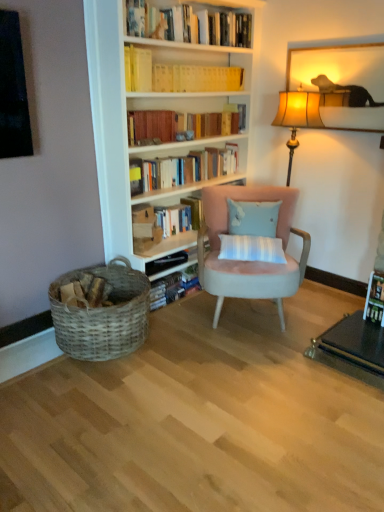
Measure the distance between yellow paperbacks at upper center, which is the 5th book from bottom to top, and camera.

yellow paperbacks at upper center, which is the 5th book from bottom to top, is 8.92 feet away from camera.

The width and height of the screenshot is (384, 512). I want to click on yellow paper at upper center, marked as the second book in a top-to-bottom arrangement, so click(x=138, y=69).

Find the location of a particular element. wooden picture frame at upper right is located at coordinates (338, 63).

What is the approximate height of hardcover books at upper center, the 2th book in the bottom-to-top sequence?

hardcover books at upper center, the 2th book in the bottom-to-top sequence, is 9.89 inches tall.

What is the approximate width of hardcover book at upper center, which is counted as the third book, starting from the top?

5.73 inches.

You are a GUI agent. You are given a task and a screenshot of the screen. Output one action in this format:
    pyautogui.click(x=<x>, y=<y>)
    Task: Click on the yellow paperbacks at upper center, which is the 1th book in top-to-bottom order
    The width and height of the screenshot is (384, 512).
    Given the screenshot: What is the action you would take?
    pyautogui.click(x=196, y=78)

Is point (360, 41) less distant than point (175, 69)?

Yes, point (360, 41) is in front of point (175, 69).

Is wooden picture frame at upper right turned away from yellow paperbacks at upper center, which is the 5th book from bottom to top?

That's not correct — wooden picture frame at upper right is not looking away from yellow paperbacks at upper center, which is the 5th book from bottom to top.

Is wooden picture frame at upper right closer to the viewer compared to yellow paperbacks at upper center, which is the 1th book in top-to-bottom order?

That is True.

The height and width of the screenshot is (512, 384). In order to click on picture frame in front of the yellow paperbacks at upper center, which is the 1th book in top-to-bottom order in this screenshot , I will do `click(338, 63)`.

From the image's perspective, is hardcover books at center, which is counted as the first book, starting from the bottom, positioned above or below wooden picture frame at upper right?

hardcover books at center, which is counted as the first book, starting from the bottom, is situated lower than wooden picture frame at upper right in the image.

What's the angular difference between hardcover books at center, which is counted as the 5th book, starting from the top, and wooden picture frame at upper right's facing directions?

hardcover books at center, which is counted as the 5th book, starting from the top, and wooden picture frame at upper right are facing 89.6 degrees away from each other.

Can you confirm if hardcover books at center, which is counted as the 5th book, starting from the top, is positioned to the left of wooden picture frame at upper right?

Yes, hardcover books at center, which is counted as the 5th book, starting from the top, is to the left of wooden picture frame at upper right.

Is wooden picture frame at upper right a part of hardcover books at center, which is counted as the 5th book, starting from the top?

That's incorrect, wooden picture frame at upper right is not inside hardcover books at center, which is counted as the 5th book, starting from the top.

Which object is further away from the camera taking this photo, yellow paperbacks at upper center, which is the 5th book from bottom to top, or wooden picture frame at upper right?

yellow paperbacks at upper center, which is the 5th book from bottom to top, is more distant.

From a real-world perspective, is yellow paperbacks at upper center, which is the 1th book in top-to-bottom order, located higher than wooden picture frame at upper right?

Yes, from a real-world perspective, yellow paperbacks at upper center, which is the 1th book in top-to-bottom order, is above wooden picture frame at upper right.

Considering the relative positions of yellow paperbacks at upper center, which is the 1th book in top-to-bottom order, and wooden picture frame at upper right in the image provided, is yellow paperbacks at upper center, which is the 1th book in top-to-bottom order, to the left of wooden picture frame at upper right from the viewer's perspective?

Yes.

Is yellow paperbacks at upper center, which is the 1th book in top-to-bottom order, far from wooden picture frame at upper right?

No, yellow paperbacks at upper center, which is the 1th book in top-to-bottom order, is in close proximity to wooden picture frame at upper right.

Consider the image. Measure the distance from wooden picture frame at upper right to suede pink armchair at center.

wooden picture frame at upper right and suede pink armchair at center are 3.30 feet apart from each other.

From a real-world perspective, between wooden picture frame at upper right and suede pink armchair at center, who is vertically lower?

From a 3D spatial view, suede pink armchair at center is below.

Between wooden picture frame at upper right and suede pink armchair at center, which one has less height?

wooden picture frame at upper right.

Between wooden picture frame at upper right and suede pink armchair at center, which one appears on the right side from the viewer's perspective?

From the viewer's perspective, wooden picture frame at upper right appears more on the right side.

Which is more distant, (141, 120) or (307, 83)?

The point (307, 83) is more distant.

Which object is thinner, hardcover book at upper center, which is counted as the third book, starting from the top, or wooden picture frame at upper right?

With smaller width is wooden picture frame at upper right.

At what (x,y) coordinates should I click in order to perform the action: click on picture frame above the hardcover book at upper center, which is counted as the third book, starting from the top (from a real-world perspective). Please return your answer as a coordinate pair (x, y). Looking at the image, I should click on (338, 63).

From the image's perspective, is hardcover book at upper center, which is counted as the third book, starting from the bottom, on top of wooden picture frame at upper right?

No, from the image's perspective, hardcover book at upper center, which is counted as the third book, starting from the bottom, is not on top of wooden picture frame at upper right.

Consider the image. From a real-world perspective, is suede pink armchair at center below yellow paper at upper center, the 4th book positioned from the bottom?

Correct, in the physical world, suede pink armchair at center is lower than yellow paper at upper center, the 4th book positioned from the bottom.

Find the location of a particular element. chair below the yellow paper at upper center, marked as the second book in a top-to-bottom arrangement (from a real-world perspective) is located at coordinates (249, 261).

Is suede pink armchair at center positioned behind yellow paper at upper center, the 4th book positioned from the bottom?

No, suede pink armchair at center is in front of yellow paper at upper center, the 4th book positioned from the bottom.

Does suede pink armchair at center have a larger size compared to yellow paper at upper center, the 4th book positioned from the bottom?

Yes.

Between yellow paperbacks at upper center, which is the 1th book in top-to-bottom order, and hardcover book at upper center, which is counted as the third book, starting from the top, which one appears on the right side from the viewer's perspective?

Positioned to the right is yellow paperbacks at upper center, which is the 1th book in top-to-bottom order.

Does point (233, 68) lie behind point (181, 119)?

Yes, point (233, 68) is behind point (181, 119).

Is hardcover book at upper center, which is counted as the third book, starting from the bottom, at the back of yellow paperbacks at upper center, which is the 5th book from bottom to top?

yellow paperbacks at upper center, which is the 5th book from bottom to top, is not turned away from hardcover book at upper center, which is counted as the third book, starting from the bottom.

In order to click on the 1st book directly beneath the yellow paperbacks at upper center, which is the 5th book from bottom to top (from a real-world perspective) in this screenshot , I will do `click(153, 126)`.

The width and height of the screenshot is (384, 512). I want to click on picture frame that is on the right side of yellow paperbacks at upper center, which is the 5th book from bottom to top, so [338, 63].

Starting from the wooden picture frame at upper right, which book is the 3rd one to the left? Please provide its 2D coordinates.

[(172, 216)]

Looking at the image, which one is located closer to yellow paper at upper center, the 4th book positioned from the bottom, wooden picture frame at upper right or yellow paperbacks at upper center, which is the 5th book from bottom to top?

Based on the image, yellow paperbacks at upper center, which is the 5th book from bottom to top, appears to be nearer to yellow paper at upper center, the 4th book positioned from the bottom.

From the image, which object appears to be nearer to hardcover books at center, which is counted as the first book, starting from the bottom, wooden picture frame at upper right or light blue fabric pillow at center?

Based on the image, light blue fabric pillow at center appears to be nearer to hardcover books at center, which is counted as the first book, starting from the bottom.

Considering their positions, is hardcover book at upper center, which is counted as the third book, starting from the bottom, positioned closer to yellow paperbacks at upper center, which is the 5th book from bottom to top, than hardcover books at upper center, the 2th book in the bottom-to-top sequence?

Among the two, hardcover book at upper center, which is counted as the third book, starting from the bottom, is located nearer to yellow paperbacks at upper center, which is the 5th book from bottom to top.

Considering their positions, is woven wood basket at lower left positioned further to yellow paper at upper center, the 4th book positioned from the bottom, than hardcover books at upper center, placed as the 4th book when sorted from top to bottom?

Among the two, woven wood basket at lower left is located further to yellow paper at upper center, the 4th book positioned from the bottom.

Considering their positions, is hardcover books at center, which is counted as the 5th book, starting from the top, positioned closer to wooden picture frame at upper right than hardcover book at upper center, which is counted as the third book, starting from the bottom?

hardcover book at upper center, which is counted as the third book, starting from the bottom, is positioned closer to the anchor wooden picture frame at upper right.

From the image, which object appears to be farther from hardcover books at upper center, the 2th book in the bottom-to-top sequence, woven wood basket at lower left or hardcover books at center, which is counted as the 5th book, starting from the top?

woven wood basket at lower left is further to hardcover books at upper center, the 2th book in the bottom-to-top sequence.

Considering their positions, is wooden picture frame at upper right positioned further to hardcover book at upper center, which is counted as the third book, starting from the top, than hardcover books at center, which is counted as the first book, starting from the bottom?

The object further to hardcover book at upper center, which is counted as the third book, starting from the top, is wooden picture frame at upper right.

Based on their spatial positions, is hardcover books at center, which is counted as the first book, starting from the bottom, or hardcover book at upper center, which is counted as the third book, starting from the top, further from light blue fabric pillow at center?

hardcover book at upper center, which is counted as the third book, starting from the top, is positioned further to the anchor light blue fabric pillow at center.

Image resolution: width=384 pixels, height=512 pixels. I want to click on chair between woven wood basket at lower left and wooden picture frame at upper right, so click(249, 261).

Find the location of a particular element. The height and width of the screenshot is (512, 384). picture frame between yellow paperbacks at upper center, which is the 5th book from bottom to top, and woven wood basket at lower left in the up-down direction is located at coordinates (338, 63).

The height and width of the screenshot is (512, 384). In order to click on chair between hardcover book at upper center, which is counted as the third book, starting from the top, and woven wood basket at lower left from top to bottom in this screenshot , I will do `click(249, 261)`.

This screenshot has height=512, width=384. I want to click on chair between hardcover book at upper center, which is counted as the third book, starting from the bottom, and wooden picture frame at upper right from left to right, so click(x=249, y=261).